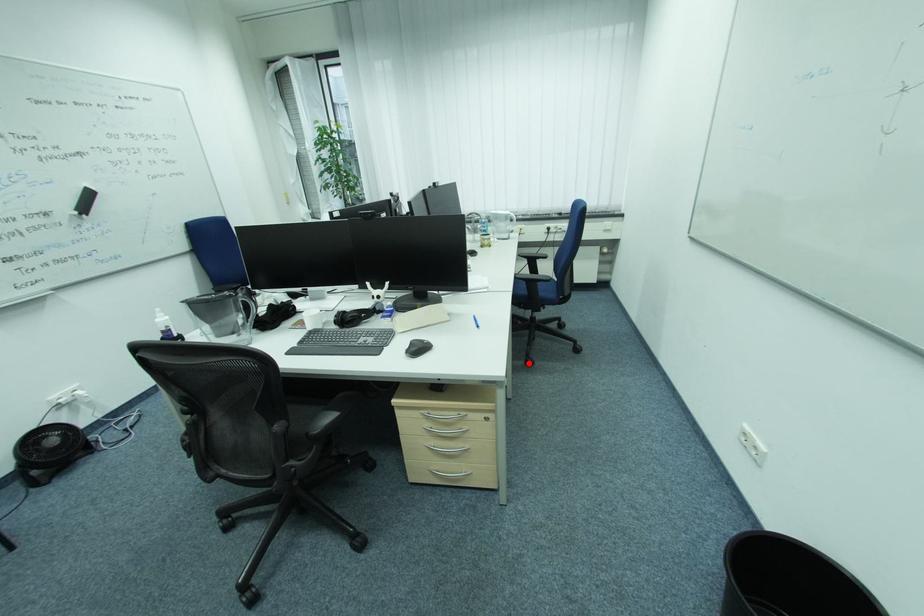
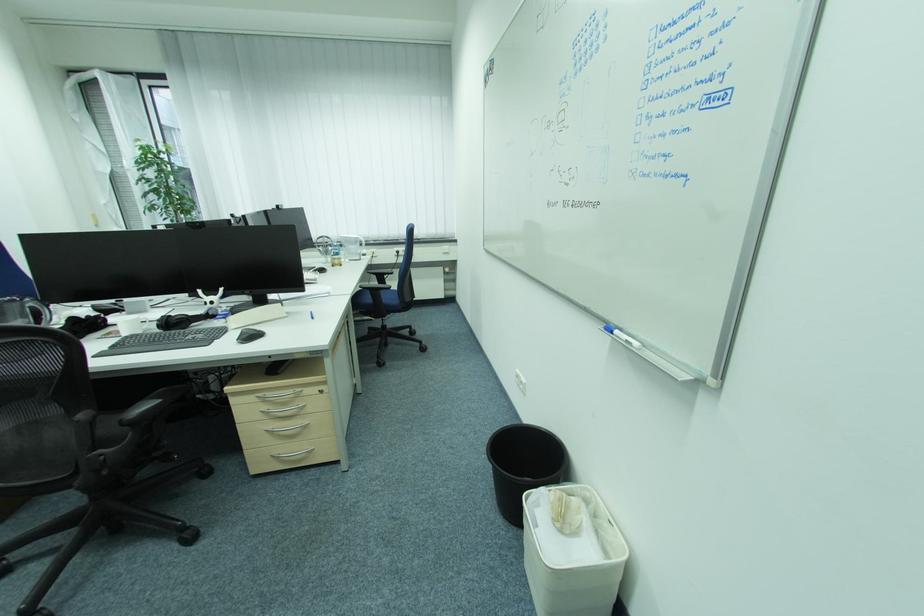
Find the pixel in the second image that matches the highlighted location in the first image.

(381, 366)